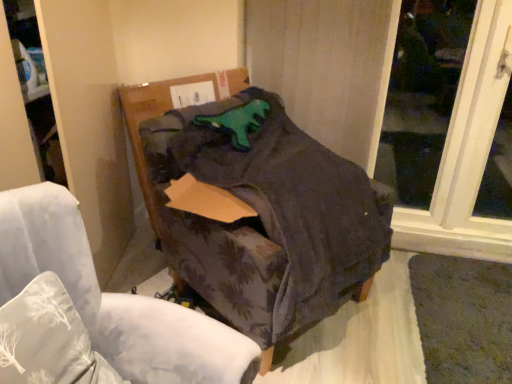
Question: From a real-world perspective, is white fabric pillow at lower left physically below cardboard box at center?

Choices:
 (A) no
 (B) yes

Answer: (B)

Question: Is the surface of white fabric pillow at lower left in direct contact with cardboard box at center?

Choices:
 (A) yes
 (B) no

Answer: (B)

Question: Is cardboard box at center at the back of white fabric pillow at lower left?

Choices:
 (A) yes
 (B) no

Answer: (B)

Question: Considering the relative sizes of white fabric pillow at lower left and cardboard box at center in the image provided, is white fabric pillow at lower left wider than cardboard box at center?

Choices:
 (A) no
 (B) yes

Answer: (B)

Question: Would you say white fabric pillow at lower left is outside cardboard box at center?

Choices:
 (A) no
 (B) yes

Answer: (B)

Question: Based on their positions, is purple floral fabric chair at center located to the left or right of white fabric pillow at lower left?

Choices:
 (A) left
 (B) right

Answer: (B)

Question: Is purple floral fabric chair at center taller or shorter than white fabric pillow at lower left?

Choices:
 (A) tall
 (B) short

Answer: (A)

Question: In terms of size, does purple floral fabric chair at center appear bigger or smaller than white fabric pillow at lower left?

Choices:
 (A) small
 (B) big

Answer: (B)

Question: Is purple floral fabric chair at center in front of or behind white fabric pillow at lower left in the image?

Choices:
 (A) behind
 (B) front

Answer: (B)

Question: From a real-world perspective, is transparent glass window at upper right above or below white fabric pillow at lower left?

Choices:
 (A) above
 (B) below

Answer: (A)

Question: In terms of size, does transparent glass window at upper right appear bigger or smaller than white fabric pillow at lower left?

Choices:
 (A) small
 (B) big

Answer: (A)

Question: Looking at their shapes, would you say transparent glass window at upper right is wider or thinner than white fabric pillow at lower left?

Choices:
 (A) thin
 (B) wide

Answer: (A)

Question: Is transparent glass window at upper right spatially inside white fabric pillow at lower left, or outside of it?

Choices:
 (A) outside
 (B) inside

Answer: (A)

Question: Looking at their shapes, would you say transparent glass window at upper right is wider or thinner than dark fabric chair at center?

Choices:
 (A) thin
 (B) wide

Answer: (A)

Question: From the image's perspective, is transparent glass window at upper right above or below dark fabric chair at center?

Choices:
 (A) below
 (B) above

Answer: (B)